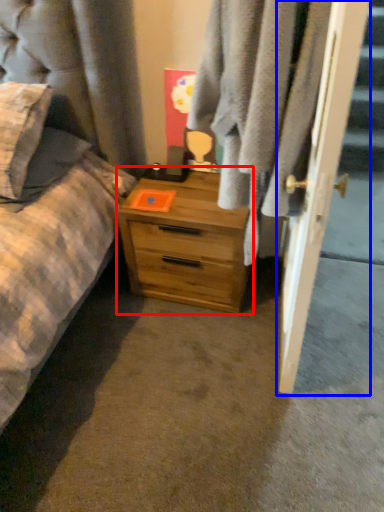
Question: Which of the following is the farthest to the observer, chest of drawers (highlighted by a red box) or door (highlighted by a blue box)?

Choices:
 (A) chest of drawers
 (B) door

Answer: (A)